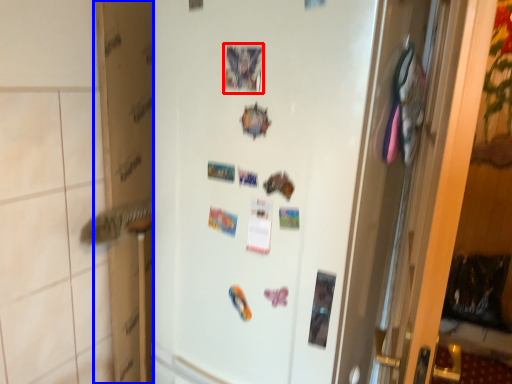
Question: Which of the following is the farthest to the observer, postcard (highlighted by a red box) or cardboard box (highlighted by a blue box)?

Choices:
 (A) postcard
 (B) cardboard box

Answer: (B)